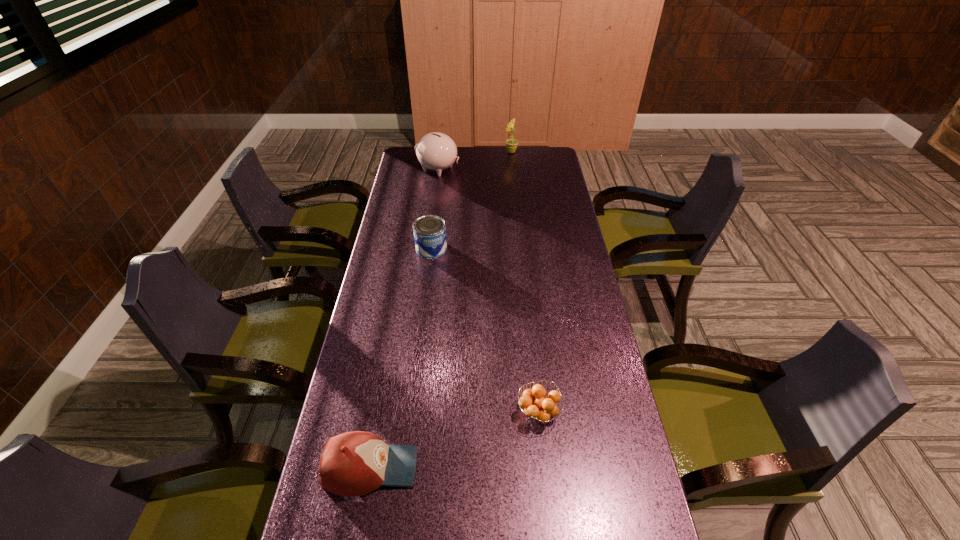
Identify the location of vacant area that lies between the second farthest object and the second nearest object. This screenshot has height=540, width=960. (489, 291).

Locate an element on the screen. This screenshot has height=540, width=960. free point between the second farthest object and the can is located at coordinates (435, 209).

Identify the location of free space between the baseball cap and the piggy bank. The height and width of the screenshot is (540, 960). (404, 318).

Locate which object ranks fourth in proximity to the farthest object. Please provide its 2D coordinates. Your answer should be formatted as a tuple, i.e. [(x, y)], where the tuple contains the x and y coordinates of a point satisfying the conditions above.

[(356, 463)]

Identify the location of object that ranks as the closest to the farthest object. click(436, 151).

Identify the location of free location that satisfies the following two spatial constraints: 1. on the face of the sunflower; 2. on the front side of the second farthest object. tap(513, 169).

Locate an element on the screen. blank space that satisfies the following two spatial constraints: 1. on the face of the second nearest object; 2. on the left side of the farthest object is located at coordinates (539, 412).

At what (x,y) coordinates should I click in order to perform the action: click on vacant space that satisfies the following two spatial constraints: 1. on the face of the shortest object; 2. on the left side of the farthest object. Please return your answer as a coordinate pair (x, y). Looking at the image, I should click on (539, 412).

In order to click on vacant region that satisfies the following two spatial constraints: 1. on the face of the farthest object; 2. on the front label of the can in this screenshot , I will do `click(521, 248)`.

Identify the location of free space that satisfies the following two spatial constraints: 1. on the back side of the orange fruit; 2. on the face of the farthest object. (512, 152).